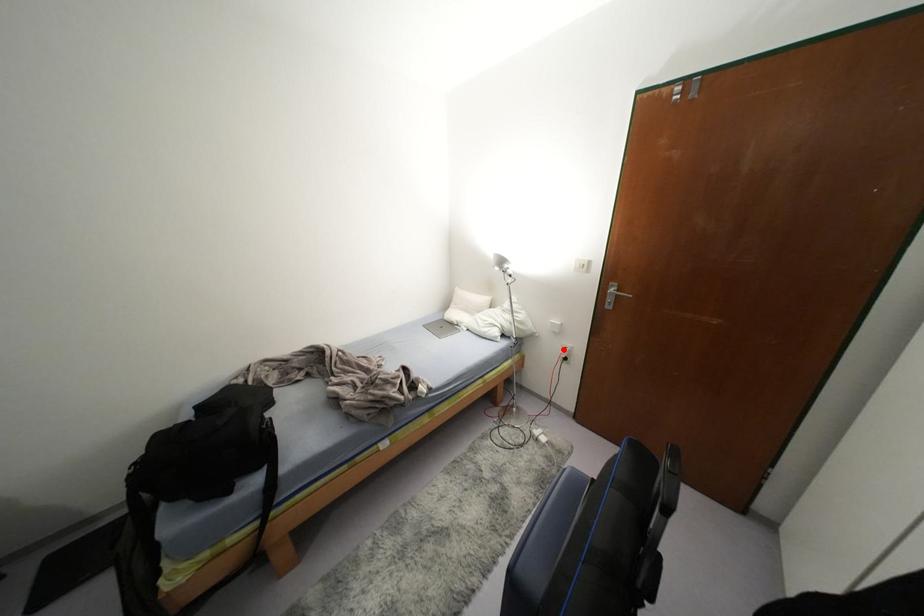
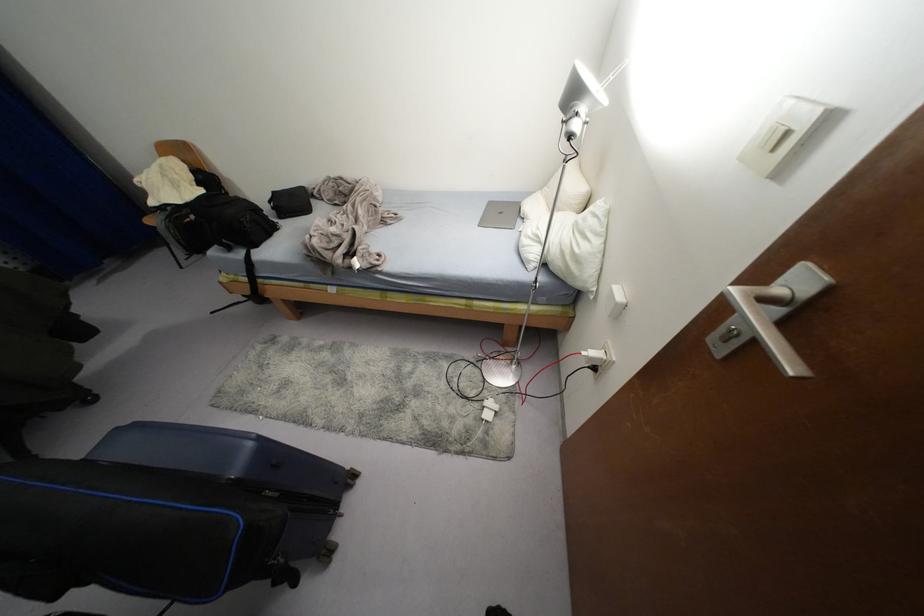
Locate, in the second image, the point that corresponds to the highlighted location in the first image.

(592, 353)